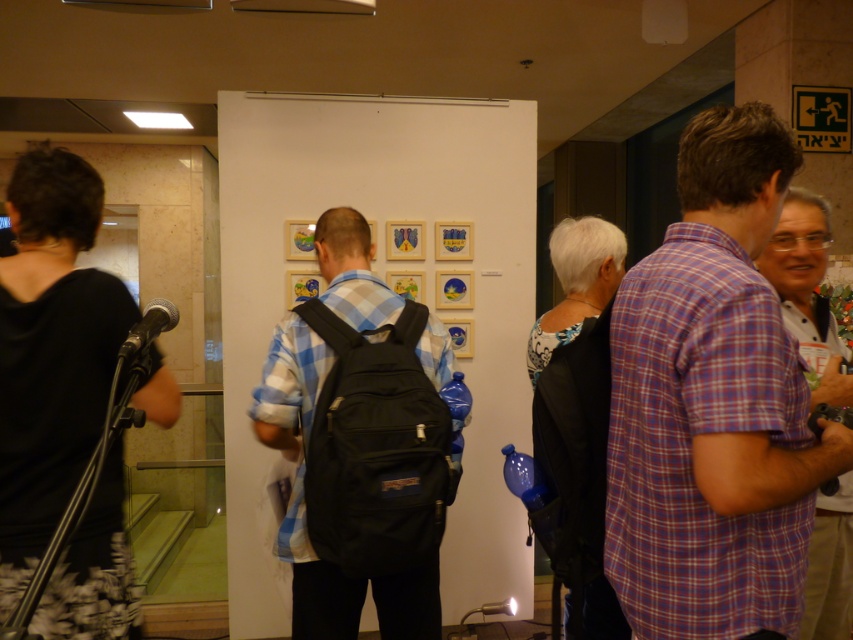
Is black fabric backpack at center above plaid cotton shirt at right?

Incorrect, black fabric backpack at center is not positioned above plaid cotton shirt at right.

Find the location of `black fabric backpack at center`. black fabric backpack at center is located at coordinates (358, 444).

In order to click on black fabric backpack at center in this screenshot , I will do `click(358, 444)`.

Is purple plaid shirt at right wider than black fabric backpack at center?

Incorrect, purple plaid shirt at right's width does not surpass black fabric backpack at center's.

Can you confirm if purple plaid shirt at right is smaller than black fabric backpack at center?

Indeed, purple plaid shirt at right has a smaller size compared to black fabric backpack at center.

Image resolution: width=853 pixels, height=640 pixels. What are the coordinates of `purple plaid shirt at right` in the screenshot? It's located at (712, 404).

How much distance is there between purple plaid shirt at right and plaid cotton shirt at right?

They are 13.82 inches apart.

Does purple plaid shirt at right have a greater width compared to plaid cotton shirt at right?

Incorrect, purple plaid shirt at right's width does not surpass plaid cotton shirt at right's.

At what (x,y) coordinates should I click in order to perform the action: click on purple plaid shirt at right. Please return your answer as a coordinate pair (x, y). The image size is (853, 640). Looking at the image, I should click on (712, 404).